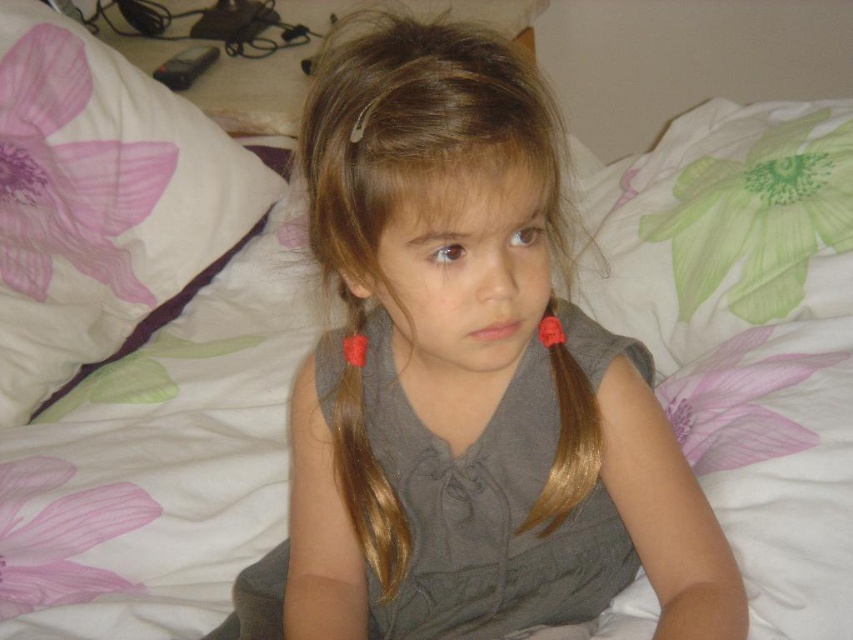
You are designing a layout for a photo shoot and need to ensure that the white fabric pillow at upper left and the gray matte dress at center are positioned correctly. Based on their sizes, which object should be placed higher up in the frame to maintain visual balance?

The white fabric pillow at upper left should be placed higher up in the frame since it has a greater height compared to the gray matte dress at center, which will help maintain visual balance.

The girl is wearing a gray matte dress at center and has shiny golden hair at center. Which of these two items is bigger in size?

The gray matte dress at center has a larger size compared to the shiny golden hair at center.